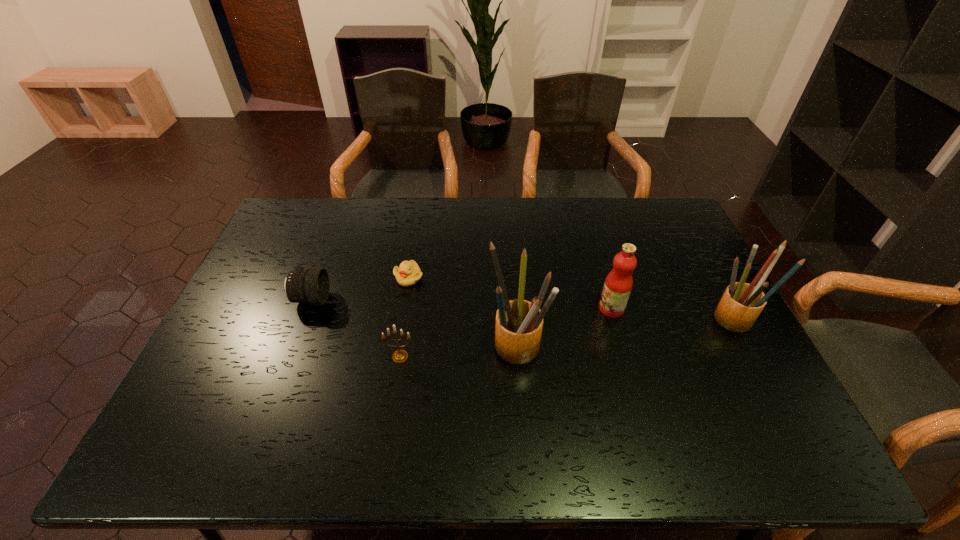
The width and height of the screenshot is (960, 540). In the image, there is a desktop. In order to click on free region at the right edge in this screenshot , I will do `click(708, 316)`.

In order to click on vacant space at the far right corner in this screenshot , I will do `click(666, 236)`.

What are the coordinates of `vacant space in between the fourth object from left to right and the telephoto lens` in the screenshot? It's located at (414, 323).

The height and width of the screenshot is (540, 960). Find the location of `vacant point located between the taller pencil box and the leftmost object`. vacant point located between the taller pencil box and the leftmost object is located at coordinates (414, 323).

In order to click on unoccupied position between the taller pencil box and the candelabrum in this screenshot , I will do `click(459, 352)`.

The image size is (960, 540). Identify the location of free space that is in between the shortest object and the leftmost object. (360, 288).

You are a GUI agent. You are given a task and a screenshot of the screen. Output one action in this format:
    pyautogui.click(x=<x>, y=<y>)
    Task: Click on the vacant area that lies between the tallest object and the shortest object
    The image size is (960, 540).
    Given the screenshot: What is the action you would take?
    pyautogui.click(x=463, y=312)

This screenshot has width=960, height=540. I want to click on unoccupied position between the candelabrum and the shortest object, so click(x=404, y=317).

At what (x,y) coordinates should I click in order to perform the action: click on unoccupied area between the candelabrum and the shortest object. Please return your answer as a coordinate pair (x, y). Looking at the image, I should click on (404, 317).

In order to click on vacant region between the fifth tallest object and the left pencil box in this screenshot , I will do `click(414, 323)`.